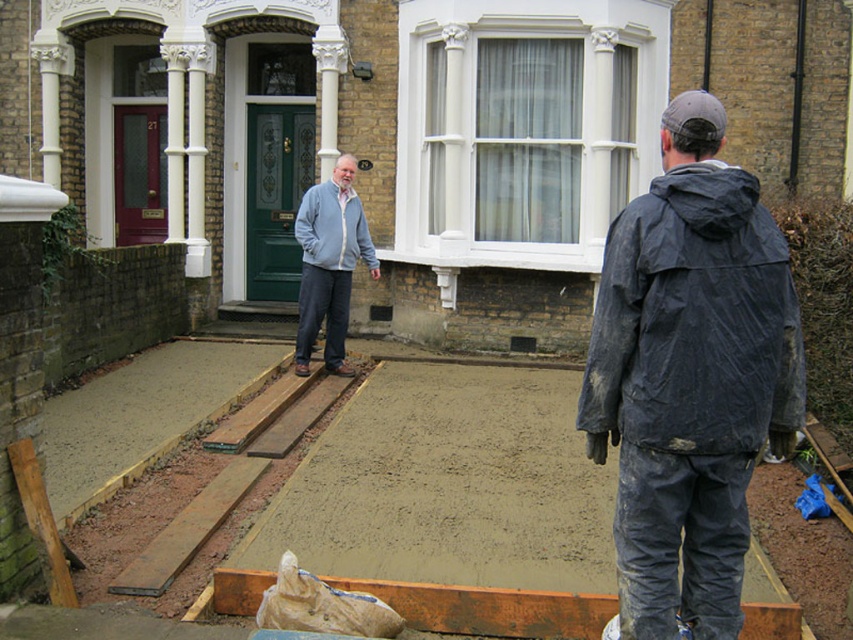
Does smooth concrete at center appear on the left side of light gray fleece jacket at center?

No, smooth concrete at center is not to the left of light gray fleece jacket at center.

Does smooth concrete at center have a lesser height compared to light gray fleece jacket at center?

Yes, smooth concrete at center is shorter than light gray fleece jacket at center.

Between point (387, 536) and point (325, 198), which one is positioned in front?

Positioned in front is point (387, 536).

Where is `smooth concrete at center`? Image resolution: width=853 pixels, height=640 pixels. smooth concrete at center is located at coordinates (447, 506).

In the scene shown: Which is more to the right, wet dark blue jacket at lower right or light gray fleece jacket at center?

From the viewer's perspective, wet dark blue jacket at lower right appears more on the right side.

Between wet dark blue jacket at lower right and light gray fleece jacket at center, which one appears on the left side from the viewer's perspective?

Positioned to the left is light gray fleece jacket at center.

This screenshot has width=853, height=640. I want to click on wet dark blue jacket at lower right, so click(x=694, y=323).

Can you confirm if wet dark blue jacket at lower right is positioned to the right of light blue zip-up sweater at center?

Indeed, wet dark blue jacket at lower right is positioned on the right side of light blue zip-up sweater at center.

Is wet dark blue jacket at lower right taller than light blue zip-up sweater at center?

In fact, wet dark blue jacket at lower right may be shorter than light blue zip-up sweater at center.

The image size is (853, 640). What are the coordinates of `wet dark blue jacket at lower right` in the screenshot? It's located at (694, 323).